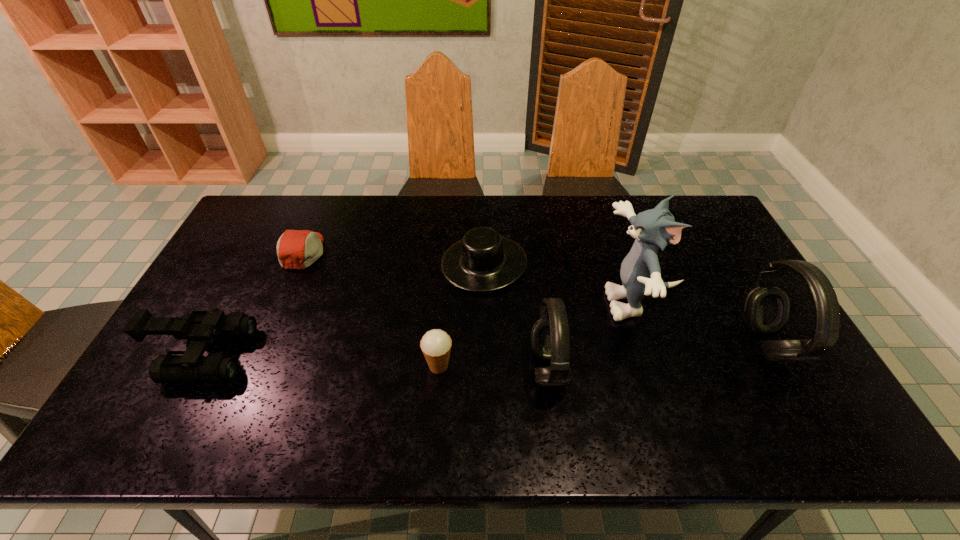
Image resolution: width=960 pixels, height=540 pixels. Find the location of `the left headset`. the left headset is located at coordinates (550, 342).

Where is `the shorter headset`? the shorter headset is located at coordinates (550, 342).

This screenshot has height=540, width=960. Identify the location of the right headset. (766, 308).

Locate an element on the screen. the taller headset is located at coordinates (766, 308).

Where is `cap`? The width and height of the screenshot is (960, 540). cap is located at coordinates (296, 249).

The width and height of the screenshot is (960, 540). I want to click on cat, so click(x=640, y=272).

Locate an element on the screen. the tallest object is located at coordinates (640, 272).

You are a GUI agent. You are given a task and a screenshot of the screen. Output one action in this format:
    pyautogui.click(x=<x>, y=<y>)
    Task: Click on the sixth tallest object
    The width and height of the screenshot is (960, 540).
    Given the screenshot: What is the action you would take?
    pyautogui.click(x=483, y=260)

This screenshot has width=960, height=540. Identify the location of icecream. (436, 344).

The image size is (960, 540). I want to click on binoculars, so click(x=201, y=327).